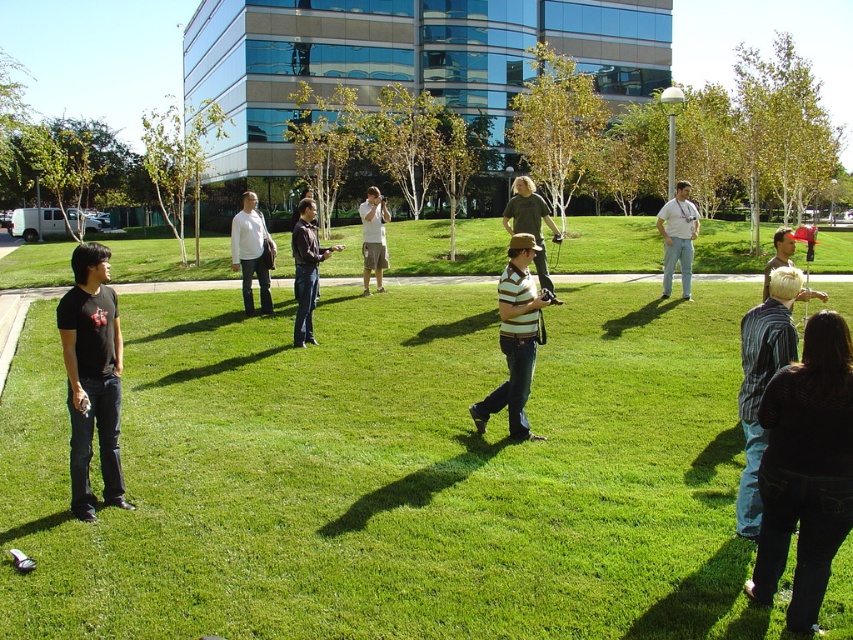
You are a photographer trying to capture a photo of the dark brown shirt at center without the dark blue jeans at lower right blocking the view. Can you adjust your position to do so?

The dark blue jeans at lower right is in front of the dark brown shirt at center, so you would need to move your position to either side or behind the dark blue jeans at lower right to frame the dark brown shirt at center without obstruction.